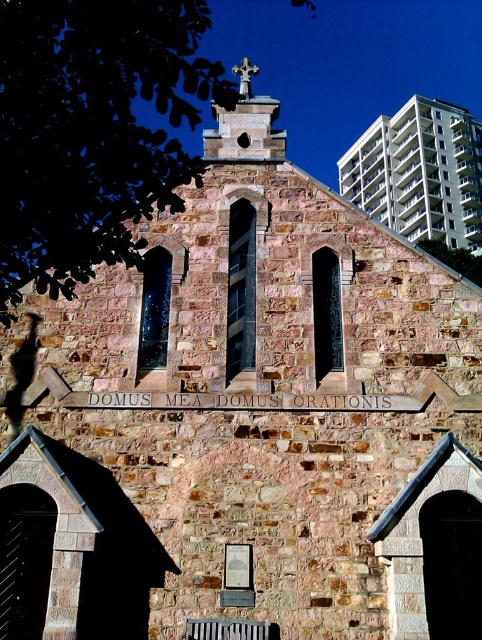
Is white concrete building at upper right shorter than smooth stone spire at upper center?

Correct, white concrete building at upper right is not as tall as smooth stone spire at upper center.

Is white concrete building at upper right to the left of smooth stone spire at upper center from the viewer's perspective?

In fact, white concrete building at upper right is to the right of smooth stone spire at upper center.

Who is more forward, (466, 230) or (239, 125)?

Point (239, 125)

Image resolution: width=482 pixels, height=640 pixels. Find the location of `white concrete building at upper right`. white concrete building at upper right is located at coordinates (419, 172).

Does white concrete building at upper right have a greater width compared to wooden slats at lower center?

Yes.

Describe the element at coordinates (419, 172) in the screenshot. I see `white concrete building at upper right` at that location.

At what (x,y) coordinates should I click in order to perform the action: click on white concrete building at upper right. Please return your answer as a coordinate pair (x, y). Looking at the image, I should click on (419, 172).

Is point (219, 156) behind point (236, 636)?

Yes, point (219, 156) is behind point (236, 636).

Which is above, smooth stone spire at upper center or wooden slats at lower center?

smooth stone spire at upper center

What are the coordinates of `smooth stone spire at upper center` in the screenshot? It's located at (245, 124).